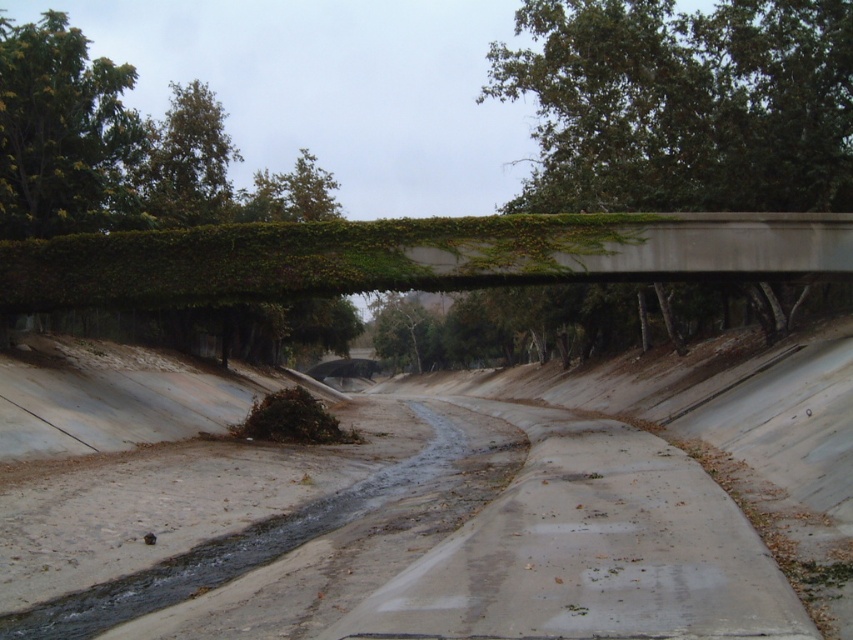
Question: Does dull concrete dirt track at center have a smaller size compared to green leafy hedge at upper center?

Choices:
 (A) yes
 (B) no

Answer: (A)

Question: Which point is closer to the camera taking this photo?

Choices:
 (A) (270, 330)
 (B) (416, 253)

Answer: (B)

Question: Which of the following is the closest to the observer?

Choices:
 (A) (722, 497)
 (B) (38, 28)

Answer: (A)

Question: Which point is closer to the camera?

Choices:
 (A) green leafy hedge at upper center
 (B) green ivy-covered concrete bridge at upper center
 (C) green leafy tree at upper center
 (D) dull concrete dirt track at center

Answer: (D)

Question: Does green ivy-covered concrete bridge at upper center lie behind green leafy hedge at upper center?

Choices:
 (A) yes
 (B) no

Answer: (B)

Question: Can you confirm if green ivy-covered concrete bridge at upper center is smaller than green leafy hedge at upper center?

Choices:
 (A) yes
 (B) no

Answer: (A)